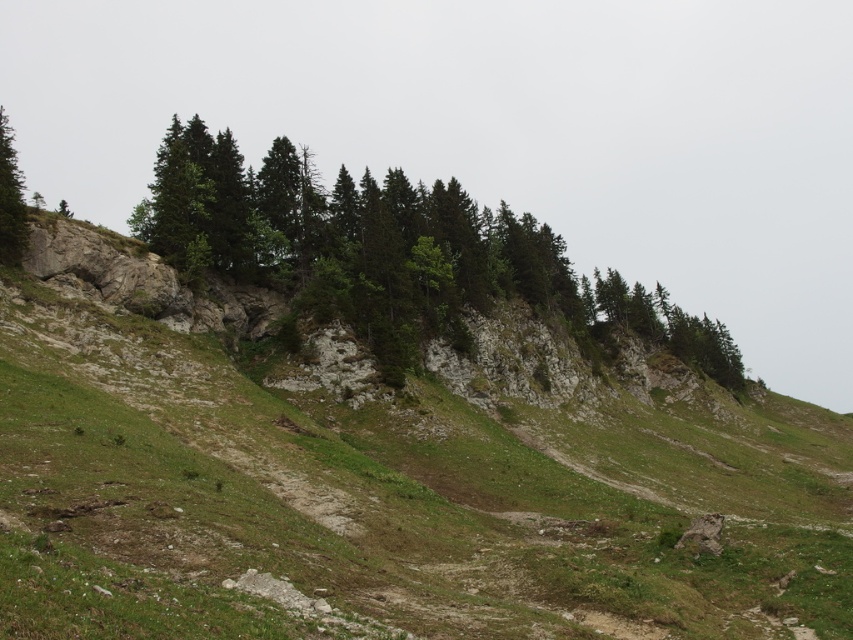
Does point (216, 225) come in front of point (20, 209)?

That is False.

Between point (569, 320) and point (3, 170), which one is positioned behind?

The point (569, 320) is behind.

Locate an element on the screen. green textured trees at center is located at coordinates (392, 253).

Does green grassy hillside at center appear on the left side of green matte tree at left?

No, green grassy hillside at center is not to the left of green matte tree at left.

Does point (82, 259) lie in front of point (3, 156)?

Yes, it is.

This screenshot has width=853, height=640. I want to click on green grassy hillside at center, so click(386, 474).

Does point (312, 461) come farther from viewer compared to point (369, 182)?

No, (312, 461) is closer to viewer.

This screenshot has width=853, height=640. What do you see at coordinates (386, 474) in the screenshot? I see `green grassy hillside at center` at bounding box center [386, 474].

Locate an element on the screen. This screenshot has width=853, height=640. green grassy hillside at center is located at coordinates (386, 474).